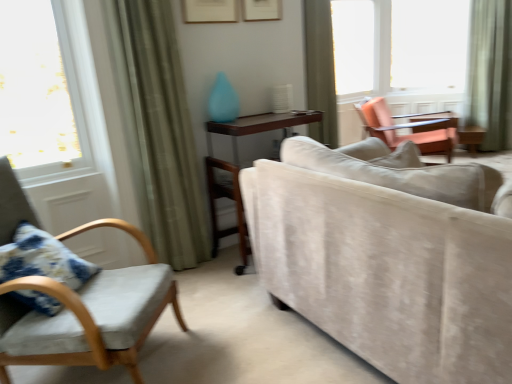
Question: Which direction should I rotate to look at green fabric curtain at upper center, the second curtain in the left-to-right sequence?

Choices:
 (A) left
 (B) right

Answer: (B)

Question: Does velvet cushioned chair at left, the 2th chair positioned from the back, appear on the left side of green fabric curtain at upper center, positioned as the 2th curtain in back-to-front order?

Choices:
 (A) no
 (B) yes

Answer: (B)

Question: Considering the relative sizes of velvet cushioned chair at left, which is the 2th chair in top-to-bottom order, and green fabric curtain at upper center, arranged as the second curtain when viewed from the right, in the image provided, is velvet cushioned chair at left, which is the 2th chair in top-to-bottom order, smaller than green fabric curtain at upper center, arranged as the second curtain when viewed from the right,?

Choices:
 (A) yes
 (B) no

Answer: (B)

Question: Is velvet cushioned chair at left, the 2th chair positioned from the back, facing towards green fabric curtain at upper center, positioned as the 2th curtain in back-to-front order?

Choices:
 (A) yes
 (B) no

Answer: (B)

Question: Does velvet cushioned chair at left, which ranks as the first chair in bottom-to-top order, lie behind green fabric curtain at upper center, the second curtain in the left-to-right sequence?

Choices:
 (A) yes
 (B) no

Answer: (B)

Question: Is velvet cushioned chair at left, the 2th chair positioned from the back, positioned far away from green fabric curtain at upper center, arranged as the second curtain when viewed from the right?

Choices:
 (A) yes
 (B) no

Answer: (A)

Question: Considering the relative sizes of velvet cushioned chair at left, acting as the first chair starting from the left, and green fabric curtain at upper center, the second curtain in the left-to-right sequence, in the image provided, is velvet cushioned chair at left, acting as the first chair starting from the left, shorter than green fabric curtain at upper center, the second curtain in the left-to-right sequence,?

Choices:
 (A) no
 (B) yes

Answer: (B)

Question: Does wooden table at center have a lesser width compared to transparent glass window at upper right, marked as the first window in a right-to-left arrangement?

Choices:
 (A) yes
 (B) no

Answer: (B)

Question: Is wooden table at center closer to camera compared to transparent glass window at upper right, placed as the 2th window when sorted from left to right?

Choices:
 (A) yes
 (B) no

Answer: (A)

Question: Considering the relative positions of wooden table at center and transparent glass window at upper right, placed as the 2th window when sorted from left to right, in the image provided, is wooden table at center behind transparent glass window at upper right, placed as the 2th window when sorted from left to right,?

Choices:
 (A) no
 (B) yes

Answer: (A)

Question: Considering the relative sizes of wooden table at center and transparent glass window at upper right, placed as the 2th window when sorted from left to right, in the image provided, is wooden table at center smaller than transparent glass window at upper right, placed as the 2th window when sorted from left to right,?

Choices:
 (A) yes
 (B) no

Answer: (B)

Question: Does wooden table at center have a lesser height compared to transparent glass window at upper right, marked as the first window in a right-to-left arrangement?

Choices:
 (A) no
 (B) yes

Answer: (B)

Question: Considering the relative positions of wooden table at center and transparent glass window at upper right, marked as the first window in a right-to-left arrangement, in the image provided, is wooden table at center to the right of transparent glass window at upper right, marked as the first window in a right-to-left arrangement, from the viewer's perspective?

Choices:
 (A) yes
 (B) no

Answer: (B)

Question: Is beige velvet couch at center positioned with its back to green fabric curtain at right, arranged as the 3th curtain when viewed from the left?

Choices:
 (A) no
 (B) yes

Answer: (A)